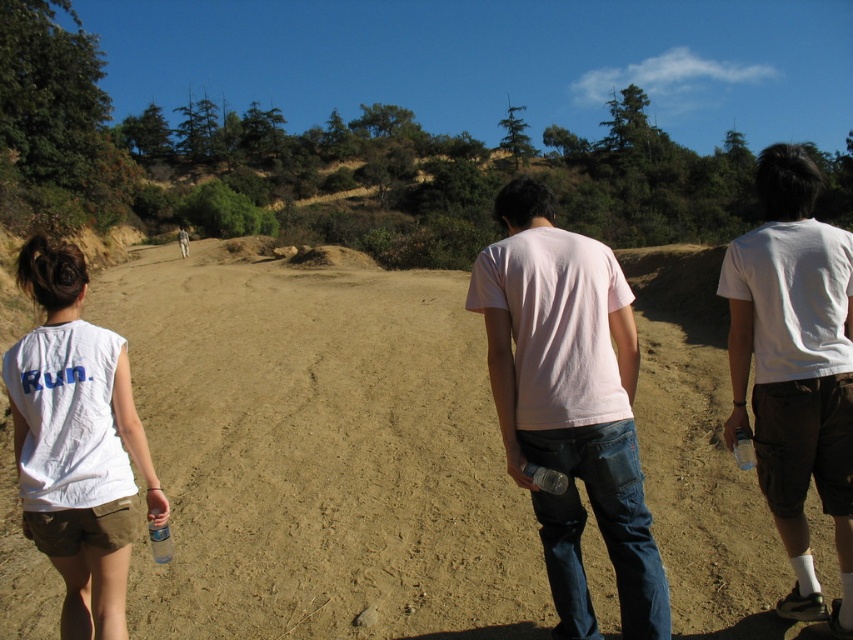
Consider the image. Can you confirm if white matte t-shirt at center is positioned to the right of white cotton t-shirt at center?

No, white matte t-shirt at center is not to the right of white cotton t-shirt at center.

Is white matte t-shirt at center above white cotton t-shirt at center?

Incorrect, white matte t-shirt at center is not positioned above white cotton t-shirt at center.

Where is `white matte t-shirt at center`? The height and width of the screenshot is (640, 853). white matte t-shirt at center is located at coordinates (569, 403).

Does white cotton t-shirt at center appear over white cotton shirt at left?

Correct, white cotton t-shirt at center is located above white cotton shirt at left.

The width and height of the screenshot is (853, 640). What are the coordinates of `white cotton t-shirt at center` in the screenshot? It's located at (795, 369).

Describe the element at coordinates (795, 369) in the screenshot. I see `white cotton t-shirt at center` at that location.

You are a GUI agent. You are given a task and a screenshot of the screen. Output one action in this format:
    pyautogui.click(x=<x>, y=<y>)
    Task: Click on the white cotton t-shirt at center
    This screenshot has width=853, height=640.
    Given the screenshot: What is the action you would take?
    pyautogui.click(x=795, y=369)

Which is more to the right, white matte t-shirt at center or white cotton shirt at left?

From the viewer's perspective, white matte t-shirt at center appears more on the right side.

Who is more forward, (550, 512) or (90, 365)?

Point (90, 365) is in front.

The height and width of the screenshot is (640, 853). I want to click on white matte t-shirt at center, so click(x=569, y=403).